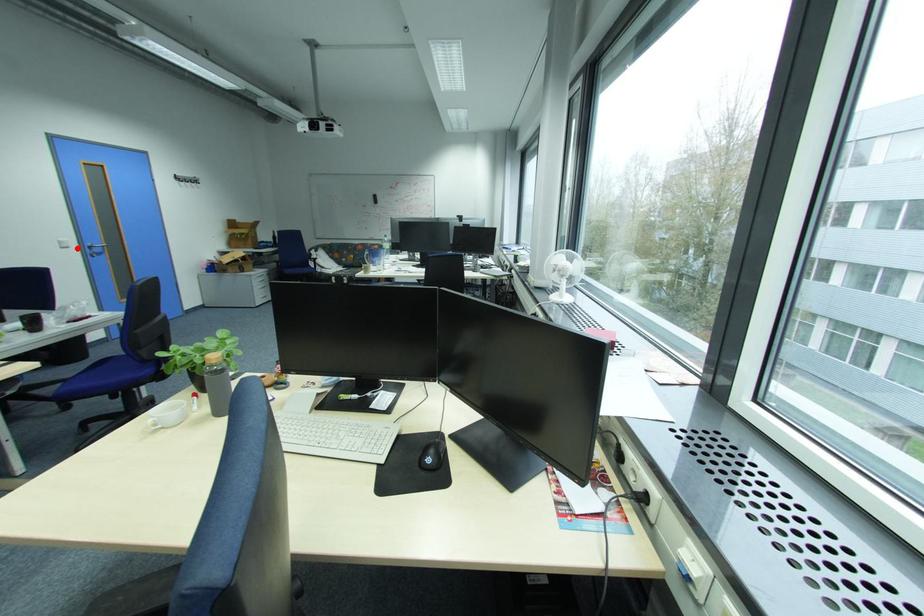
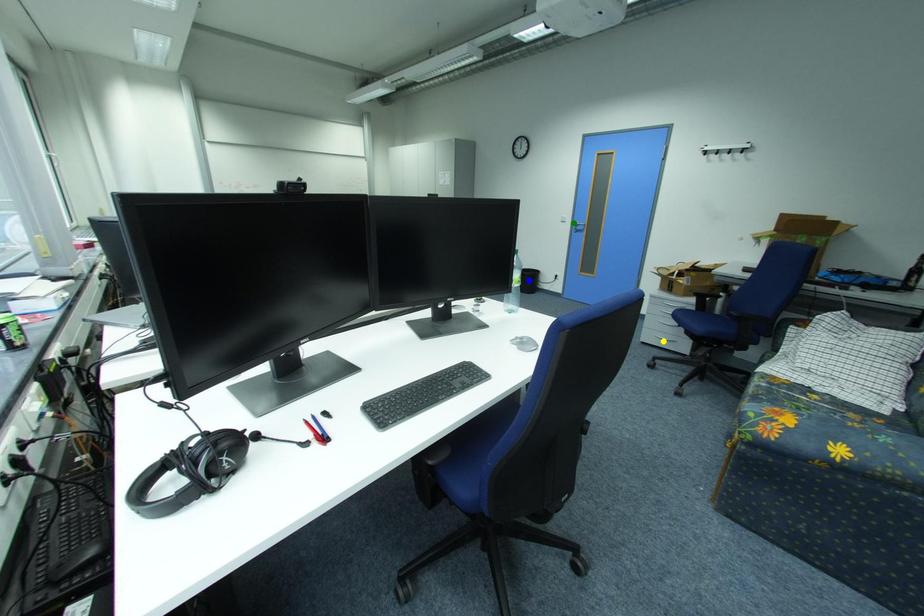
Question: I am providing you with two images of the same scene from different viewpoints. A red point is marked on the first image. You are given multiple points on the second image. Which point in image 2 is actually the same real-world point as the red point in image 1?

Choices:
 (A) yellow point
 (B) blue point
 (C) green point

Answer: (C)